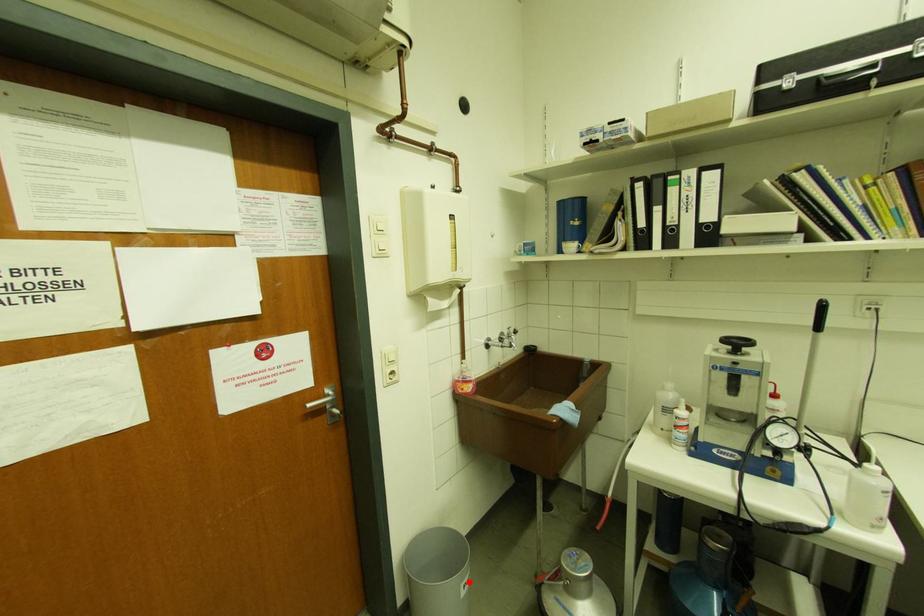
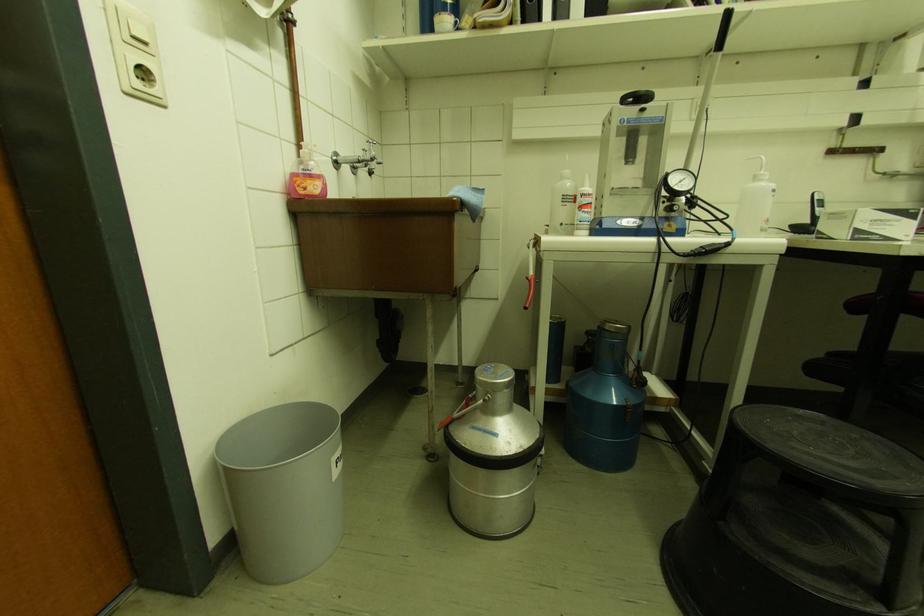
In the second image, find the point that corresponds to the highlighted location in the first image.

(341, 455)